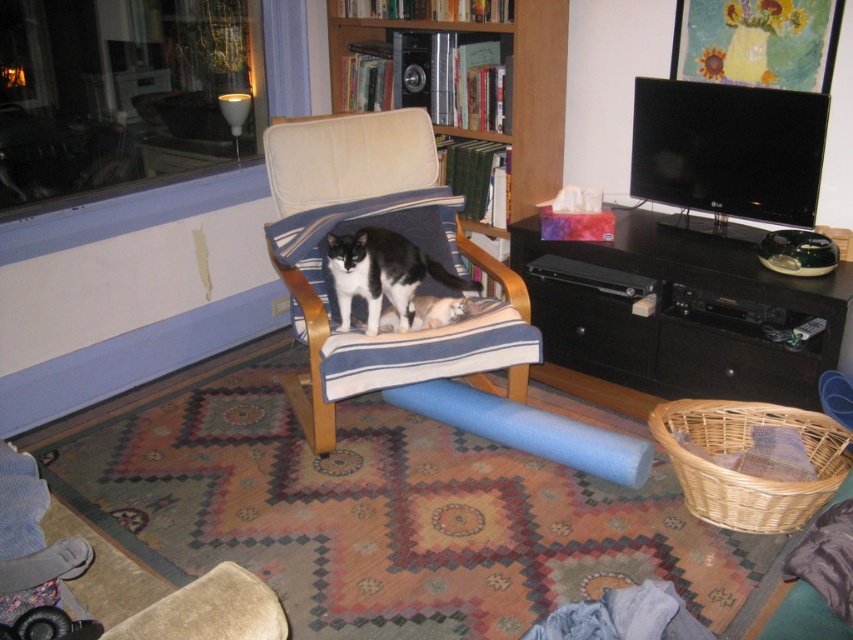
Does soft beige fabric rocking chair at center appear on the left side of wooden bookshelf at upper center?

Yes, soft beige fabric rocking chair at center is to the left of wooden bookshelf at upper center.

Can you confirm if soft beige fabric rocking chair at center is taller than wooden bookshelf at upper center?

Correct, soft beige fabric rocking chair at center is much taller as wooden bookshelf at upper center.

Image resolution: width=853 pixels, height=640 pixels. What do you see at coordinates (347, 157) in the screenshot? I see `soft beige fabric rocking chair at center` at bounding box center [347, 157].

Image resolution: width=853 pixels, height=640 pixels. What are the coordinates of `soft beige fabric rocking chair at center` in the screenshot? It's located at (347, 157).

Identify the location of soft beige fabric rocking chair at center. (347, 157).

Can you confirm if soft beige fabric rocking chair at center is taller than black fur cat at center?

Yes, soft beige fabric rocking chair at center is taller than black fur cat at center.

The height and width of the screenshot is (640, 853). I want to click on soft beige fabric rocking chair at center, so click(x=347, y=157).

At what (x,y) coordinates should I click in order to perform the action: click on soft beige fabric rocking chair at center. Please return your answer as a coordinate pair (x, y). This screenshot has width=853, height=640. Looking at the image, I should click on click(x=347, y=157).

Is black wood entertainment center at right further to the viewer compared to soft beige fabric rocking chair at center?

No, it is not.

Can you confirm if black wood entertainment center at right is wider than soft beige fabric rocking chair at center?

Yes.

I want to click on black wood entertainment center at right, so click(x=682, y=316).